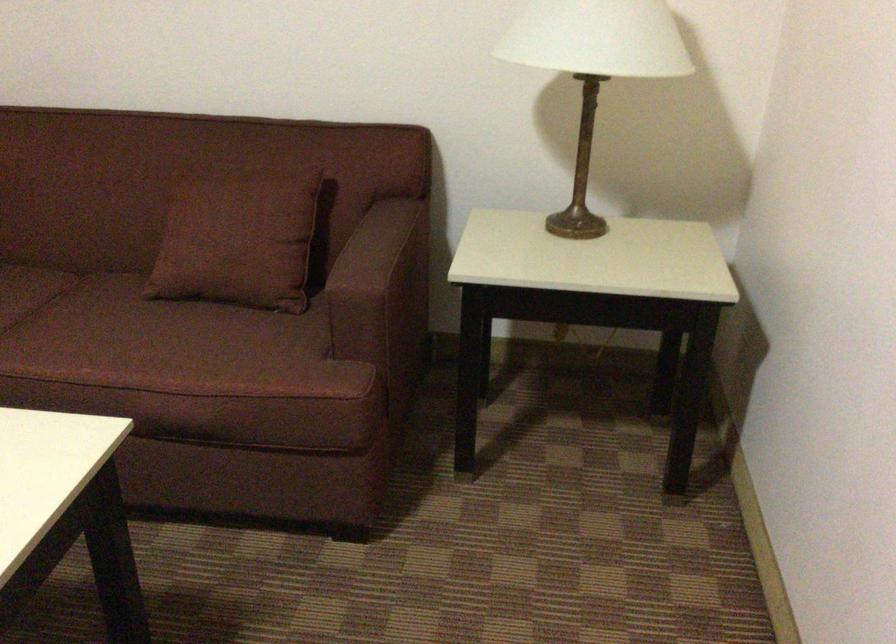
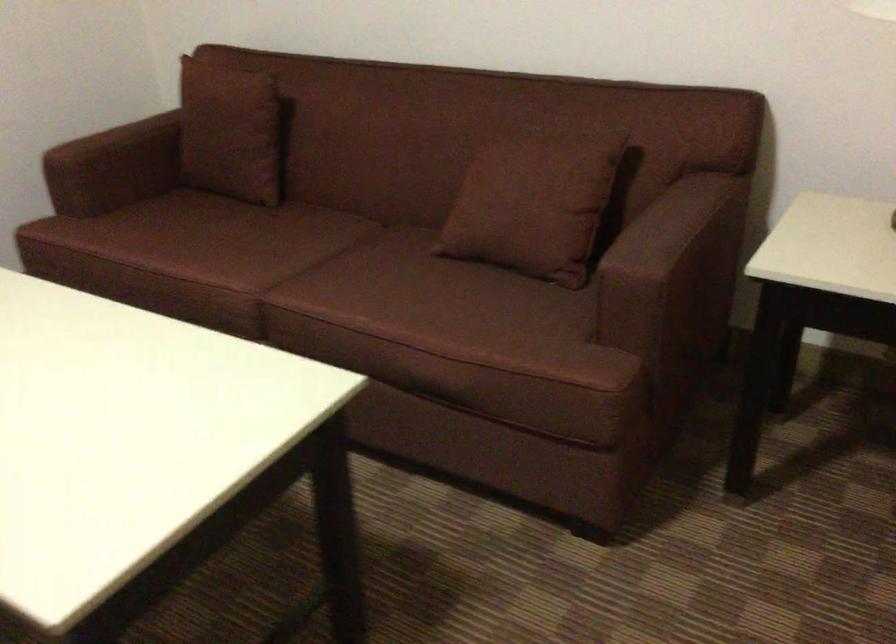
Question: Based on the continuous images, in which direction is the camera rotating? Reply with the corresponding letter.

Choices:
 (A) Left
 (B) Right
 (C) Up
 (D) Down

Answer: (A)